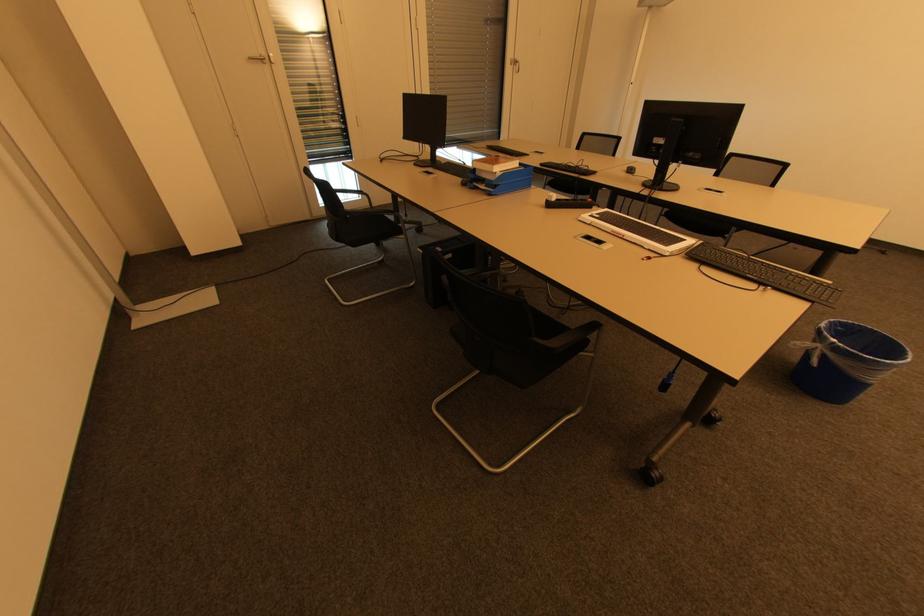
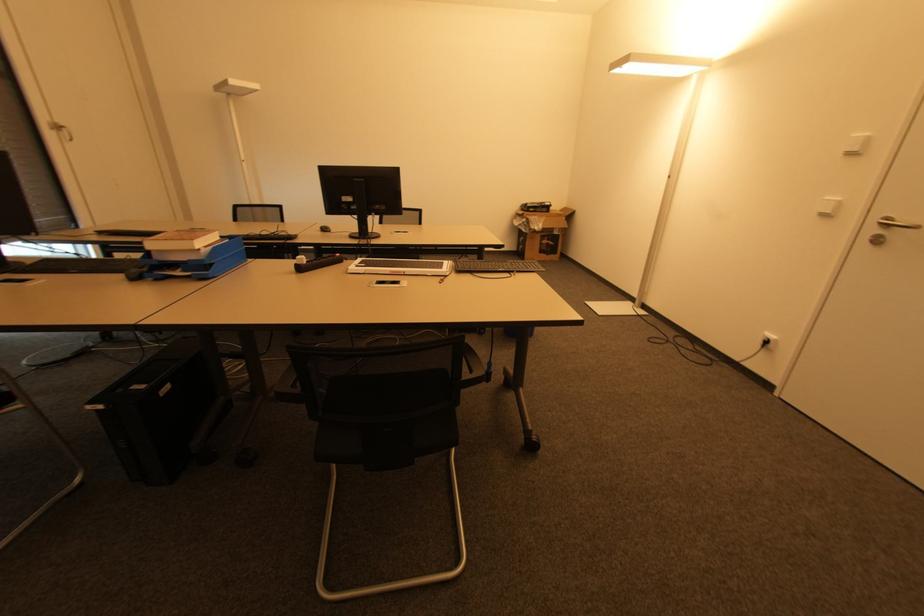
Where in the second image is the point corresponding to pixel 444 163 from the first image?

(30, 264)